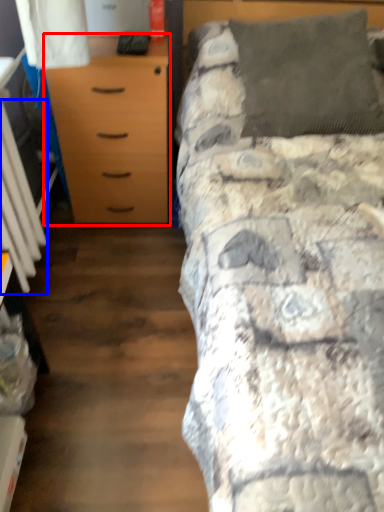
Question: Which point is closer to the camera, chest of drawers (highlighted by a red box) or radiator (highlighted by a blue box)?

Choices:
 (A) chest of drawers
 (B) radiator

Answer: (B)